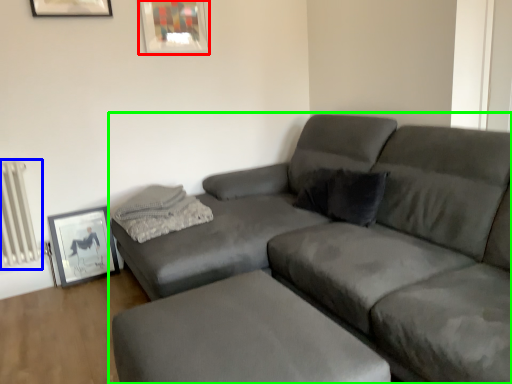
Question: Considering the real-world distances, which object is farthest from picture frame (highlighted by a red box)? radiator (highlighted by a blue box) or studio couch (highlighted by a green box)?

Choices:
 (A) radiator
 (B) studio couch

Answer: (B)